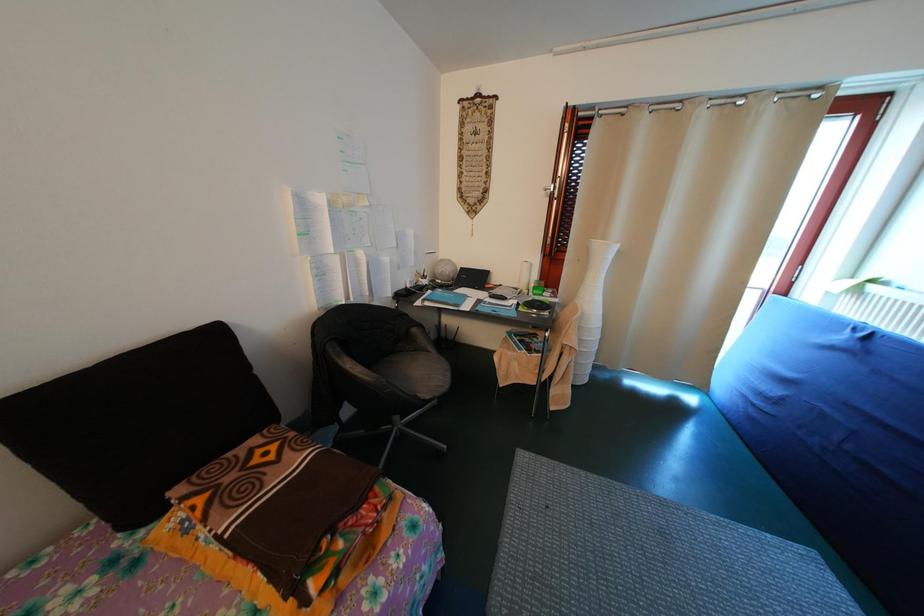
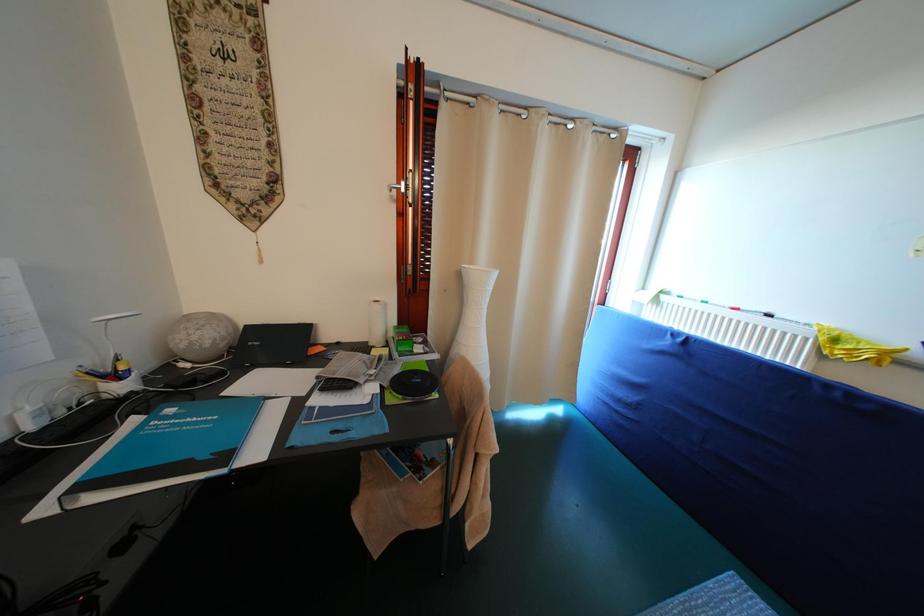
Question: How did the camera likely rotate?

Choices:
 (A) Left
 (B) Right
 (C) Up
 (D) Down

Answer: (B)